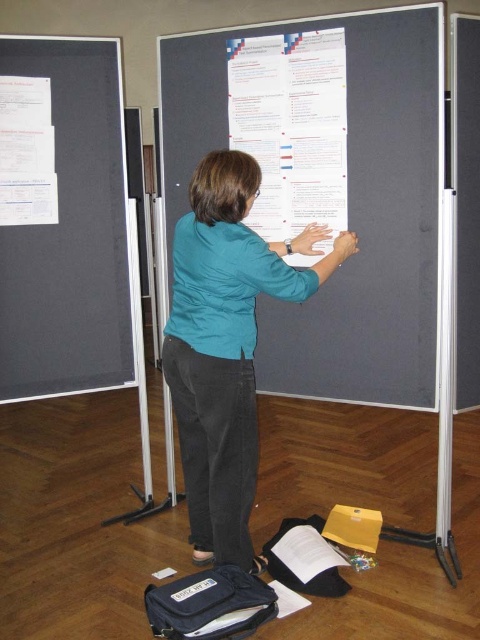
Question: Can you confirm if white paper at center is wider than white paper at upper left?

Choices:
 (A) no
 (B) yes

Answer: (B)

Question: Which object is positioned closest to the matte gray poster at center?

Choices:
 (A) white paper at center
 (B) dark gray matte board at left
 (C) teal fabric shirt at center
 (D) white paper at upper left

Answer: (A)

Question: Which point is closer to the camera?

Choices:
 (A) (240, 138)
 (B) (0, 368)

Answer: (A)

Question: Can you confirm if teal fabric shirt at center is bigger than white paper at upper left?

Choices:
 (A) yes
 (B) no

Answer: (A)

Question: Can you confirm if teal fabric shirt at center is bigger than white paper at upper left?

Choices:
 (A) yes
 (B) no

Answer: (A)

Question: Which point appears closest to the camera in this image?

Choices:
 (A) (183, 449)
 (B) (335, 397)
 (C) (231, 45)
 (D) (56, 189)

Answer: (A)